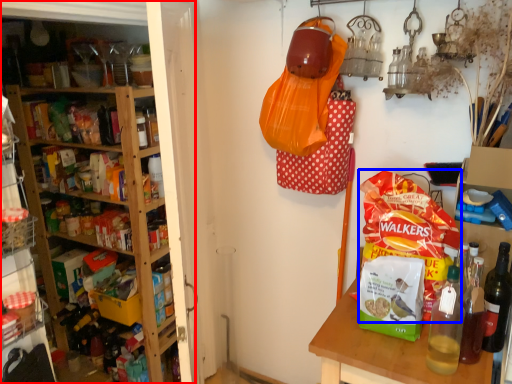
Question: Among these objects, which one is nearest to the camera, shelf (highlighted by a red box) or snack (highlighted by a blue box)?

Choices:
 (A) shelf
 (B) snack

Answer: (A)